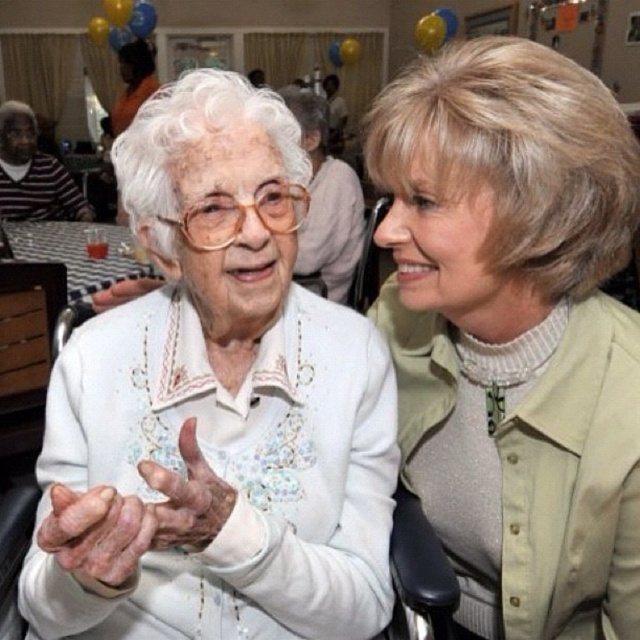
Does light beige sweater at center have a lesser height compared to dry skin hand at center?

No.

At what (x,y) coordinates should I click in order to perform the action: click on light beige sweater at center. Please return your answer as a coordinate pair (x, y). The image size is (640, 640). Looking at the image, I should click on (515, 330).

Can you confirm if dry wrinkled hand at center is shorter than white matte hand at center?

In fact, dry wrinkled hand at center may be taller than white matte hand at center.

Does point (125, 568) lie behind point (109, 300)?

That is False.

Measure the distance between point (134, 499) and camera.

They are 20.42 inches apart.

At what (x,y) coordinates should I click in order to perform the action: click on dry wrinkled hand at center. Please return your answer as a coordinate pair (x, y). Looking at the image, I should click on (97, 532).

In order to click on light beige sweater at center in this screenshot , I will do `click(515, 330)`.

Can you confirm if light beige sweater at center is positioned above white matte hand at center?

Incorrect, light beige sweater at center is not positioned above white matte hand at center.

Is point (429, 460) farther from viewer compared to point (134, 292)?

No, (429, 460) is in front of (134, 292).

Find the location of `light beige sweater at center`. light beige sweater at center is located at coordinates (515, 330).